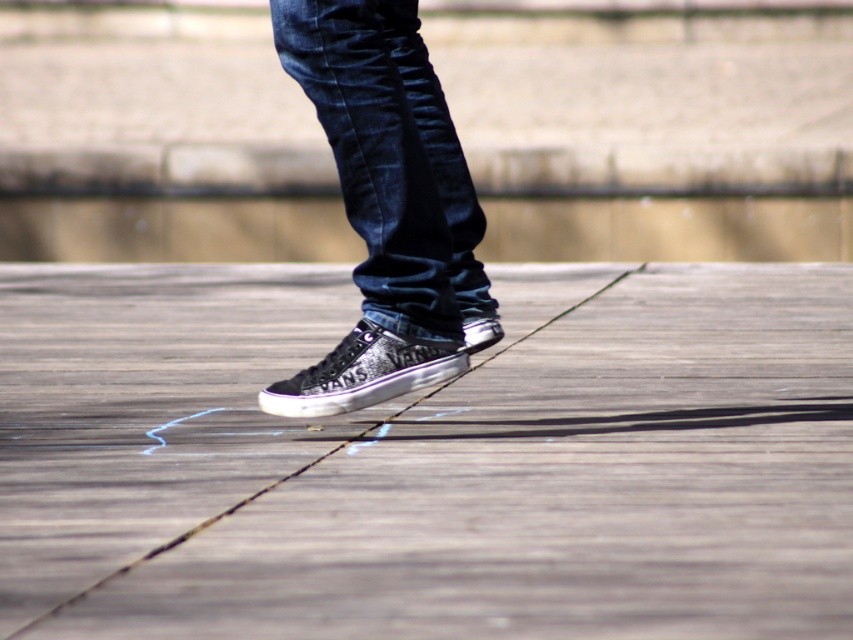
Question: Which is nearer to the wooden at center?

Choices:
 (A) shiny black sneaker at center
 (B) denim at center

Answer: (A)

Question: Which point is farther to the camera?

Choices:
 (A) (265, 410)
 (B) (486, 282)
 (C) (184, 413)
 (D) (468, 320)

Answer: (C)

Question: Does denim at center have a larger size compared to glittery black sneakers at center?

Choices:
 (A) no
 (B) yes

Answer: (B)

Question: Is wooden at center closer to camera compared to denim at center?

Choices:
 (A) no
 (B) yes

Answer: (B)

Question: Which point is farther to the camera?

Choices:
 (A) wooden at center
 (B) denim at center
 (C) glittery black sneakers at center
 (D) shiny black sneaker at center

Answer: (D)

Question: Can you confirm if wooden at center is positioned above glittery black sneakers at center?

Choices:
 (A) no
 (B) yes

Answer: (B)